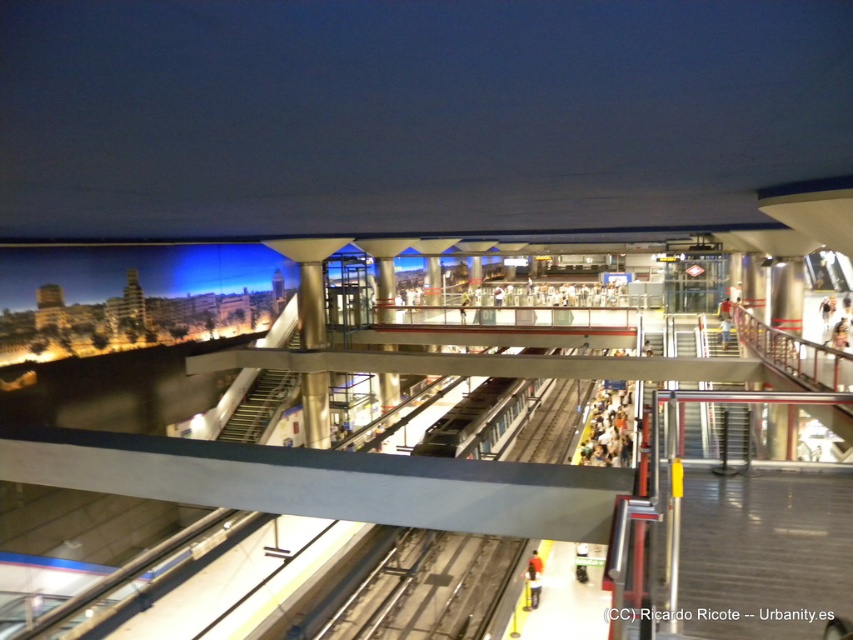
Question: Which point is closer to the camera taking this photo?

Choices:
 (A) pos(532,592)
 (B) pos(602,422)

Answer: (A)

Question: Where is matte black crowd at lower center located in relation to matte black jacket at lower center in the image?

Choices:
 (A) left
 (B) right

Answer: (B)

Question: Is matte black crowd at lower center to the right of matte black jacket at lower center from the viewer's perspective?

Choices:
 (A) yes
 (B) no

Answer: (A)

Question: Among these points, which one is nearest to the camera?

Choices:
 (A) (531, 589)
 (B) (630, 432)

Answer: (A)

Question: Where is matte black crowd at lower center located in relation to matte black jacket at lower center in the image?

Choices:
 (A) below
 (B) above

Answer: (B)